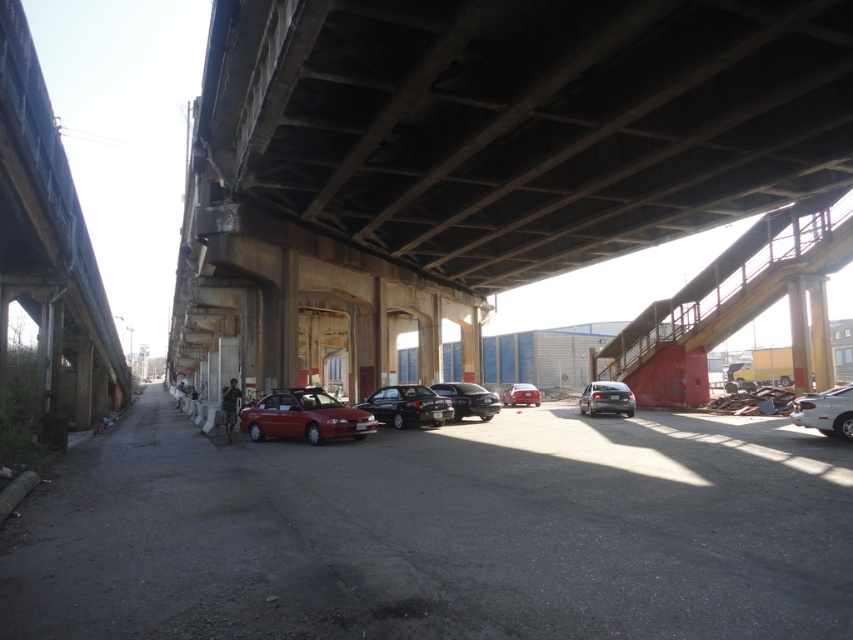
You are a delivery driver who needs to park your van, which is 6 meters long, under the bridge. The glossy red sedan at center and the white glossy sedan at right are already parked there. Based on the scene, can you determine if there is enough space between the two sedans to park your van?

The glossy red sedan at center occupies less space than white glossy sedan at right. However, without knowing the exact distance between them, it is impossible to determine if there is enough space for a 6 meter van. Please check the available space physically.

You are a delivery driver who needs to park your truck, which is 2 meters wide, in this area. Looking at the image, can you determine if the shiny red car at center and the glossy red sedan at center have enough space between them to accommodate your truck?

The shiny red car at center is wider than the glossy red sedan at center. However, the description does not provide specific measurements of the space between them, so it is unclear if there is enough room for the truck.

You are standing at the point marked by coordinates point (305, 417) in the image. What object is directly beneath you?

The glossy red sedan at center is located at point (305, 417), so the object directly beneath you is the glossy red sedan at center.